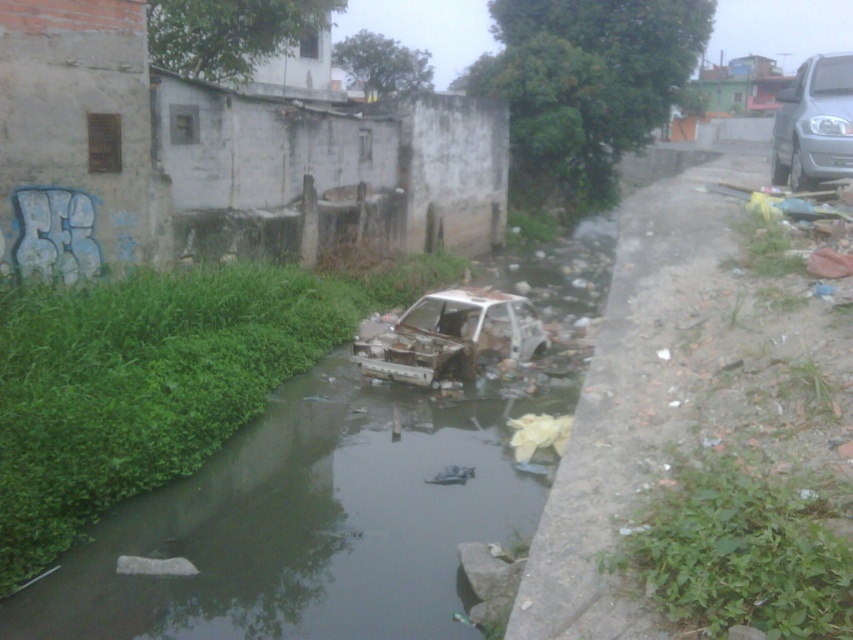
You are a city inspector assessing the scene. You need to determine if the rusty metal car at center is positioned lower than the silver metallic van at right. Based on the spatial relationship between them, what is your conclusion?

The rusty metal car at center is below the silver metallic van at right, so it is positioned lower than the van.

You are a city planner assessing the area for cleanup. You need to move the rusty metal car at center and the silver metallic van at right. The crane you have can lift objects up to 5 meters apart. Can the crane safely lift both vehicles at the same time?

The distance between the rusty metal car at center and the silver metallic van at right is 5.47 meters, which exceeds the crane capacity of 5 meters. Therefore, the crane cannot safely lift both vehicles simultaneously.

You are a city planner assessing the area for cleanup. You need to prioritize removing the rusty metal car at center and the silver metallic van at right. Which vehicle should be addressed first if you want to tackle the one closer to the waterway first?

The rusty metal car at center should be addressed first because it is closer to the waterway than the silver metallic van at right, which is positioned behind it.